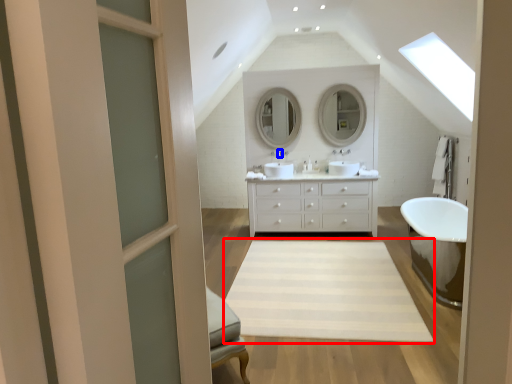
Question: Among these objects, which one is farthest to the camera, plain (highlighted by a red box) or faucet (highlighted by a blue box)?

Choices:
 (A) plain
 (B) faucet

Answer: (B)